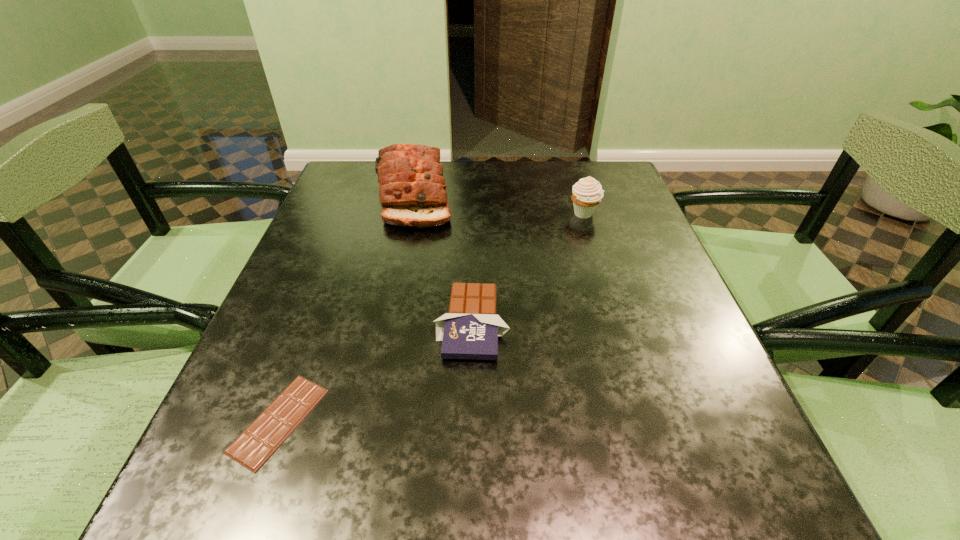
In order to click on free space at the near edge in this screenshot , I will do `click(404, 490)`.

This screenshot has width=960, height=540. Find the location of `vacant space at the left edge`. vacant space at the left edge is located at coordinates (274, 312).

At what (x,y) coordinates should I click in order to perform the action: click on vacant space at the right edge of the desktop. Please return your answer as a coordinate pair (x, y). This screenshot has width=960, height=540. Looking at the image, I should click on [677, 345].

In the image, there is a desktop. Where is `vacant area at the far left corner`? The image size is (960, 540). vacant area at the far left corner is located at coordinates (375, 198).

Identify the location of vacant region at the far right corner of the desktop. (568, 186).

At what (x,y) coordinates should I click in order to perform the action: click on vacant space at the near right corner of the desktop. Please return your answer as a coordinate pair (x, y). The image size is (960, 540). Looking at the image, I should click on (789, 524).

Where is `vacant space in between the bread and the muffin`? The image size is (960, 540). vacant space in between the bread and the muffin is located at coordinates (499, 204).

The width and height of the screenshot is (960, 540). In order to click on free point between the rightmost object and the taller chocolate bar in this screenshot , I will do `click(528, 268)`.

I want to click on empty space that is in between the bread and the nearest object, so click(347, 307).

Locate an element on the screen. The image size is (960, 540). free spot between the muffin and the farther chocolate bar is located at coordinates (528, 268).